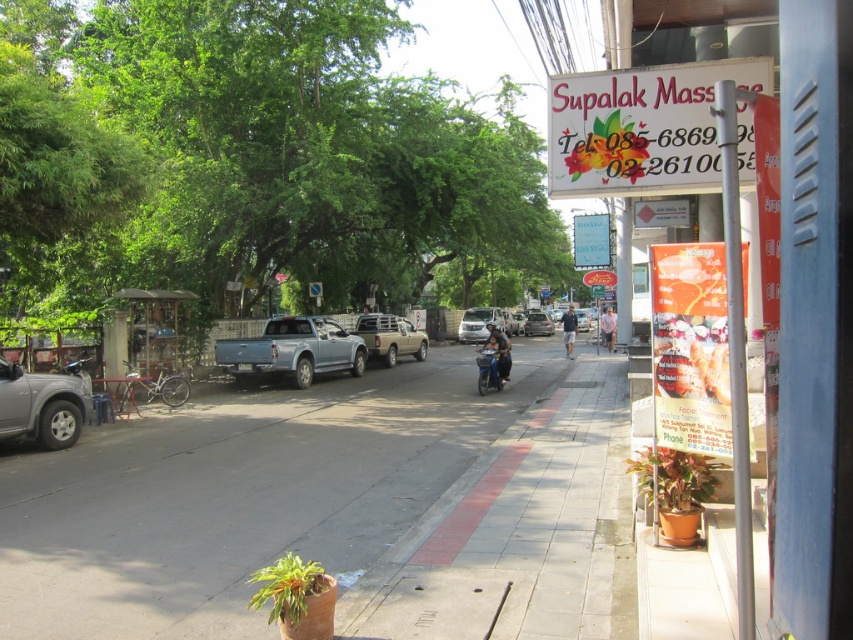
Question: Which point is closer to the camera?

Choices:
 (A) (192, 220)
 (B) (531, 321)

Answer: (A)

Question: Which object is the farthest from the green leafy tree at upper center?

Choices:
 (A) satin silver car at center
 (B) silver metallic suv at left
 (C) light blue metallic truck at center

Answer: (A)

Question: Which object is the farthest from the white paper sign at upper center?

Choices:
 (A) metallic silver motorcycle at center
 (B) gold metallic pickup truck at center
 (C) white plastic sign at upper right

Answer: (C)

Question: Does green leafy tree at upper center have a lesser width compared to gold metallic pickup truck at center?

Choices:
 (A) no
 (B) yes

Answer: (A)

Question: Is smooth concrete sidewalk at center bigger than white paper sign at upper center?

Choices:
 (A) no
 (B) yes

Answer: (A)

Question: Observing the image, what is the correct spatial positioning of gold metallic pickup truck at center in reference to white matte car at center?

Choices:
 (A) below
 (B) above

Answer: (A)